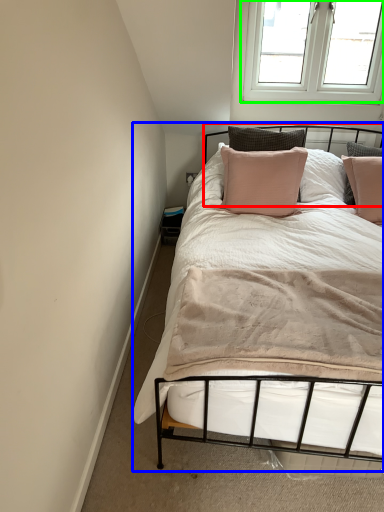
Question: Based on their relative distances, which object is farther from headboard (highlighted by a red box)? Choose from bed (highlighted by a blue box) and window (highlighted by a green box).

Choices:
 (A) bed
 (B) window

Answer: (A)